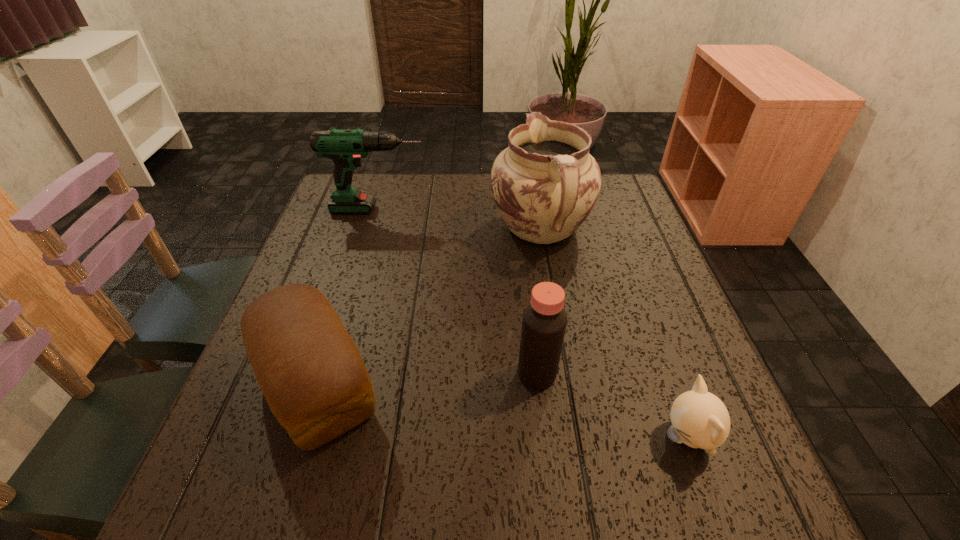
Where is `vacant position located on the face of the rightmost object`? The image size is (960, 540). vacant position located on the face of the rightmost object is located at coordinates (633, 437).

The width and height of the screenshot is (960, 540). Find the location of `free space located 0.390m on the face of the rightmost object`. free space located 0.390m on the face of the rightmost object is located at coordinates (434, 437).

Where is `blank area located 0.250m on the face of the rightmost object`? The width and height of the screenshot is (960, 540). blank area located 0.250m on the face of the rightmost object is located at coordinates (516, 437).

Where is `pitcher at the far edge`? The height and width of the screenshot is (540, 960). pitcher at the far edge is located at coordinates point(545,184).

This screenshot has width=960, height=540. I want to click on drill present at the far edge, so click(x=346, y=147).

Find the location of a particular element. This screenshot has width=960, height=540. object positioned at the near edge is located at coordinates (699, 419).

Locate an element on the screen. The height and width of the screenshot is (540, 960). drill that is at the left edge is located at coordinates (346, 147).

This screenshot has width=960, height=540. What are the coordinates of `bread located in the left edge section of the desktop` in the screenshot? It's located at (310, 371).

Identify the location of pitcher situated at the right edge. Image resolution: width=960 pixels, height=540 pixels. (545, 184).

I want to click on kitten located at the right edge, so (x=699, y=419).